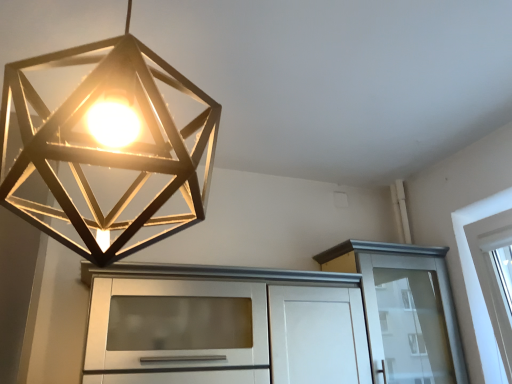
Find the location of `white glossy cabinet at center, which appears as the first cabinetry when viewed from the left`. white glossy cabinet at center, which appears as the first cabinetry when viewed from the left is located at coordinates (223, 326).

What are the coordinates of `white glossy cabinet at center, which appears as the first cabinetry when viewed from the left` in the screenshot? It's located at (223, 326).

Looking at this image, is metallic geometric light at upper center smaller than white glossy cabinet at upper right, positioned as the first cabinetry in right-to-left order?

Yes.

Is metallic geometric light at upper center shorter than white glossy cabinet at upper right, the 2th cabinetry from the left?

Incorrect, the height of metallic geometric light at upper center does not fall short of that of white glossy cabinet at upper right, the 2th cabinetry from the left.

Can you tell me how much metallic geometric light at upper center and white glossy cabinet at upper right, positioned as the first cabinetry in right-to-left order, differ in facing direction?

The facing directions of metallic geometric light at upper center and white glossy cabinet at upper right, positioned as the first cabinetry in right-to-left order, are 90 degrees apart.

Can you tell me how much white glossy cabinet at center, the 2th cabinetry viewed from the right, and white glossy cabinet at upper right, positioned as the first cabinetry in right-to-left order, differ in facing direction?

They differ by 0.000154 degrees in their facing directions.

Consider the image. Who is smaller, white glossy cabinet at center, the 2th cabinetry viewed from the right, or white glossy cabinet at upper right, the 2th cabinetry from the left?

white glossy cabinet at upper right, the 2th cabinetry from the left.

Do you think white glossy cabinet at center, which appears as the first cabinetry when viewed from the left, is within white glossy cabinet at upper right, positioned as the first cabinetry in right-to-left order, or outside of it?

white glossy cabinet at center, which appears as the first cabinetry when viewed from the left, is outside white glossy cabinet at upper right, positioned as the first cabinetry in right-to-left order.

Would you consider white glossy cabinet at center, the 2th cabinetry viewed from the right, to be distant from white glossy cabinet at upper right, positioned as the first cabinetry in right-to-left order?

No, there isn't a large distance between white glossy cabinet at center, the 2th cabinetry viewed from the right, and white glossy cabinet at upper right, positioned as the first cabinetry in right-to-left order.

Is white glossy cabinet at upper right, positioned as the first cabinetry in right-to-left order, directly adjacent to white glossy cabinet at center, which appears as the first cabinetry when viewed from the left?

No, white glossy cabinet at upper right, positioned as the first cabinetry in right-to-left order, is not beside white glossy cabinet at center, which appears as the first cabinetry when viewed from the left.

Is white glossy cabinet at center, the 2th cabinetry viewed from the right, at the back of white glossy cabinet at upper right, positioned as the first cabinetry in right-to-left order?

No.

From the image's perspective, is white glossy cabinet at upper right, the 2th cabinetry from the left, above or below white glossy cabinet at center, which appears as the first cabinetry when viewed from the left?

Based on their image positions, white glossy cabinet at upper right, the 2th cabinetry from the left, is located beneath white glossy cabinet at center, which appears as the first cabinetry when viewed from the left.

From a real-world perspective, is white glossy cabinet at upper right, positioned as the first cabinetry in right-to-left order, located higher than white glossy cabinet at center, which appears as the first cabinetry when viewed from the left?

Yes, from a real-world perspective, white glossy cabinet at upper right, positioned as the first cabinetry in right-to-left order, is above white glossy cabinet at center, which appears as the first cabinetry when viewed from the left.

Which object is more forward, white glossy cabinet at center, the 2th cabinetry viewed from the right, or metallic geometric light at upper center?

metallic geometric light at upper center.

Is white glossy cabinet at center, the 2th cabinetry viewed from the right, spatially inside metallic geometric light at upper center, or outside of it?

white glossy cabinet at center, the 2th cabinetry viewed from the right, is not enclosed by metallic geometric light at upper center.

Is white glossy cabinet at center, which appears as the first cabinetry when viewed from the left, placed right next to metallic geometric light at upper center?

No, white glossy cabinet at center, which appears as the first cabinetry when viewed from the left, is not making contact with metallic geometric light at upper center.

Considering the relative sizes of white glossy cabinet at center, which appears as the first cabinetry when viewed from the left, and metallic geometric light at upper center in the image provided, is white glossy cabinet at center, which appears as the first cabinetry when viewed from the left, bigger than metallic geometric light at upper center?

Yes, white glossy cabinet at center, which appears as the first cabinetry when viewed from the left, is bigger than metallic geometric light at upper center.

Based on the photo, can you tell me how much metallic geometric light at upper center and white glossy cabinet at center, the 2th cabinetry viewed from the right, differ in facing direction?

metallic geometric light at upper center and white glossy cabinet at center, the 2th cabinetry viewed from the right, are facing 90 degrees away from each other.

Is metallic geometric light at upper center not near white glossy cabinet at center, which appears as the first cabinetry when viewed from the left?

metallic geometric light at upper center is actually quite close to white glossy cabinet at center, which appears as the first cabinetry when viewed from the left.

Does point (0, 188) lie in front of point (180, 292)?

Yes.

Considering the positions of points (356, 240) and (193, 177), is point (356, 240) farther from camera compared to point (193, 177)?

That is True.

Is white glossy cabinet at upper right, positioned as the first cabinetry in right-to-left order, turned away from metallic geometric light at upper center?

That's not correct — white glossy cabinet at upper right, positioned as the first cabinetry in right-to-left order, is not looking away from metallic geometric light at upper center.

Is white glossy cabinet at upper right, positioned as the first cabinetry in right-to-left order, positioned beyond the bounds of metallic geometric light at upper center?

Yes, white glossy cabinet at upper right, positioned as the first cabinetry in right-to-left order, is not within metallic geometric light at upper center.

Identify the location of lamp on the left of white glossy cabinet at upper right, positioned as the first cabinetry in right-to-left order. (106, 144).

Where is `cabinetry that is on the right side of white glossy cabinet at center, which appears as the first cabinetry when viewed from the left`? The image size is (512, 384). cabinetry that is on the right side of white glossy cabinet at center, which appears as the first cabinetry when viewed from the left is located at coordinates (406, 302).

Considering their positions, is white glossy cabinet at upper right, positioned as the first cabinetry in right-to-left order, positioned closer to metallic geometric light at upper center than white glossy cabinet at center, the 2th cabinetry viewed from the right?

Based on the image, white glossy cabinet at center, the 2th cabinetry viewed from the right, appears to be nearer to metallic geometric light at upper center.

From the image, which object appears to be nearer to white glossy cabinet at upper right, the 2th cabinetry from the left, metallic geometric light at upper center or white glossy cabinet at center, which appears as the first cabinetry when viewed from the left?

Among the two, white glossy cabinet at center, which appears as the first cabinetry when viewed from the left, is located nearer to white glossy cabinet at upper right, the 2th cabinetry from the left.

From the image, which object appears to be nearer to white glossy cabinet at upper right, positioned as the first cabinetry in right-to-left order, white glossy cabinet at center, the 2th cabinetry viewed from the right, or metallic geometric light at upper center?

Based on the image, white glossy cabinet at center, the 2th cabinetry viewed from the right, appears to be nearer to white glossy cabinet at upper right, positioned as the first cabinetry in right-to-left order.

From the image, which object appears to be nearer to white glossy cabinet at center, the 2th cabinetry viewed from the right, white glossy cabinet at upper right, the 2th cabinetry from the left, or metallic geometric light at upper center?

Among the two, white glossy cabinet at upper right, the 2th cabinetry from the left, is located nearer to white glossy cabinet at center, the 2th cabinetry viewed from the right.

Looking at the image, which one is located closer to metallic geometric light at upper center, white glossy cabinet at center, which appears as the first cabinetry when viewed from the left, or white glossy cabinet at upper right, the 2th cabinetry from the left?

white glossy cabinet at center, which appears as the first cabinetry when viewed from the left.

Based on their spatial positions, is metallic geometric light at upper center or white glossy cabinet at upper right, the 2th cabinetry from the left, closer to white glossy cabinet at center, which appears as the first cabinetry when viewed from the left?

white glossy cabinet at upper right, the 2th cabinetry from the left, is positioned closer to the anchor white glossy cabinet at center, which appears as the first cabinetry when viewed from the left.

Identify the location of cabinetry between metallic geometric light at upper center and white glossy cabinet at upper right, positioned as the first cabinetry in right-to-left order, in the front-back direction. The width and height of the screenshot is (512, 384). (223, 326).